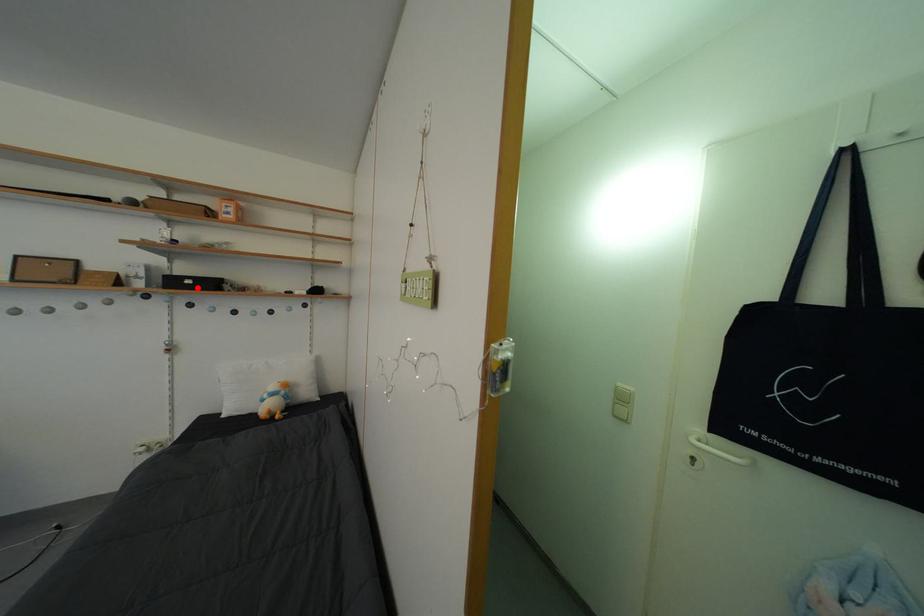
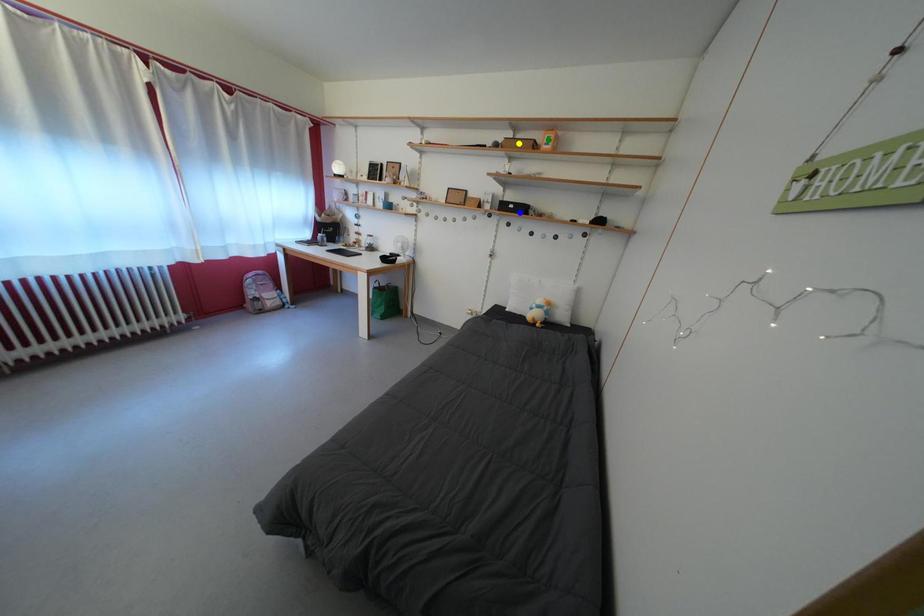
Question: I am providing you with two images of the same scene from different viewpoints. A red point is marked on the first image. You are given multiple points on the second image. Which point in image 2 represents the same 3d spot as the red point in image 1?

Choices:
 (A) yellow point
 (B) blue point
 (C) green point

Answer: (B)